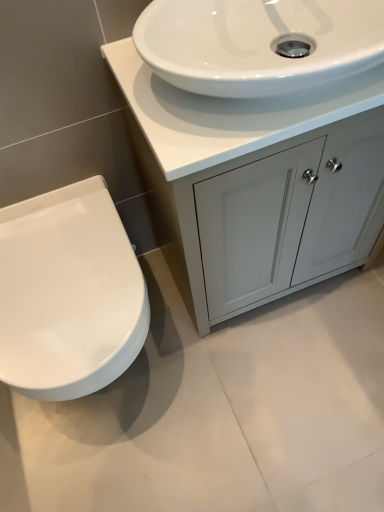
What is the approximate width of matte white cabinet at center?

It is 15.22 inches.

The image size is (384, 512). What do you see at coordinates (68, 293) in the screenshot? I see `white glossy toilet at left` at bounding box center [68, 293].

Measure the distance between white glossy sink at upper center and camera.

They are 26.61 inches apart.

I want to click on white glossy sink at upper center, so click(228, 113).

Locate an element on the screen. Image resolution: width=384 pixels, height=512 pixels. matte white cabinet at center is located at coordinates (224, 136).

Can you tell me how much white glossy sink at upper center and white glossy toilet at left differ in facing direction?

The angular difference between white glossy sink at upper center and white glossy toilet at left is 0.404 degrees.

Is white glossy sink at upper center at the left side of white glossy toilet at left?

Incorrect, white glossy sink at upper center is not on the left side of white glossy toilet at left.

Does white glossy sink at upper center come in front of white glossy toilet at left?

Yes, the depth of white glossy sink at upper center is less than that of white glossy toilet at left.

Is white glossy sink at upper center taller than white glossy toilet at left?

No.

From the image's perspective, relative to matte white cabinet at center, is white glossy toilet at left above or below?

Based on their image positions, white glossy toilet at left is located beneath matte white cabinet at center.

Is white glossy toilet at left touching matte white cabinet at center?

No, white glossy toilet at left is not in contact with matte white cabinet at center.

Is white glossy toilet at left smaller than matte white cabinet at center?

Correct, white glossy toilet at left occupies less space than matte white cabinet at center.

Which of these two, white glossy toilet at left or matte white cabinet at center, stands shorter?

Standing shorter between the two is white glossy toilet at left.

From a real-world perspective, which object stands above the other?

matte white cabinet at center, from a real-world perspective.

From the picture: Considering the sizes of objects matte white cabinet at center and white glossy toilet at left in the image provided, who is bigger, matte white cabinet at center or white glossy toilet at left?

With larger size is matte white cabinet at center.

Is matte white cabinet at center not within white glossy toilet at left?

That's correct, matte white cabinet at center is outside of white glossy toilet at left.

Does point (127, 308) appear closer or farther from the camera than point (176, 164)?

Point (127, 308).

Where is `counter top on the right side of white glossy toilet at left`? The height and width of the screenshot is (512, 384). counter top on the right side of white glossy toilet at left is located at coordinates (228, 113).

Is white glossy toilet at left not close to white glossy sink at upper center?

white glossy toilet at left is actually quite close to white glossy sink at upper center.

Can you confirm if white glossy toilet at left is wider than white glossy sink at upper center?

Correct, the width of white glossy toilet at left exceeds that of white glossy sink at upper center.

Is matte white cabinet at center not near white glossy sink at upper center?

matte white cabinet at center is near white glossy sink at upper center, not far away.

Does point (323, 124) come closer to viewer compared to point (264, 134)?

That is False.

Is matte white cabinet at center positioned with its back to white glossy sink at upper center?

No, matte white cabinet at center is not facing away from white glossy sink at upper center.

From a real-world perspective, is matte white cabinet at center over white glossy sink at upper center?

Actually, matte white cabinet at center is physically below white glossy sink at upper center in the real world.

Considering the relative sizes of white glossy sink at upper center and matte white cabinet at center in the image provided, is white glossy sink at upper center taller than matte white cabinet at center?

In fact, white glossy sink at upper center may be shorter than matte white cabinet at center.

Considering the positions of objects white glossy sink at upper center and matte white cabinet at center in the image provided, who is behind, white glossy sink at upper center or matte white cabinet at center?

matte white cabinet at center is behind.

How many degrees apart are the facing directions of white glossy sink at upper center and matte white cabinet at center?

There is a 0.00183-degree angle between the facing directions of white glossy sink at upper center and matte white cabinet at center.

Which object is positioned more to the left, white glossy sink at upper center or matte white cabinet at center?

white glossy sink at upper center.

Locate an element on the screen. This screenshot has height=512, width=384. counter top that appears above the white glossy toilet at left (from a real-world perspective) is located at coordinates (228, 113).

At what (x,y) coordinates should I click in order to perform the action: click on toilet that is under the matte white cabinet at center (from a real-world perspective). Please return your answer as a coordinate pair (x, y). The image size is (384, 512). Looking at the image, I should click on (68, 293).

Based on their spatial positions, is white glossy toilet at left or matte white cabinet at center further from white glossy sink at upper center?

white glossy toilet at left is further to white glossy sink at upper center.

Estimate the real-world distances between objects in this image. Which object is further from white glossy toilet at left, matte white cabinet at center or white glossy sink at upper center?

white glossy sink at upper center lies further to white glossy toilet at left than the other object.

Looking at the image, which one is located further to matte white cabinet at center, white glossy sink at upper center or white glossy toilet at left?

white glossy toilet at left is positioned further to the anchor matte white cabinet at center.

In the scene shown: Estimate the real-world distances between objects in this image. Which object is closer to matte white cabinet at center, white glossy toilet at left or white glossy sink at upper center?

Among the two, white glossy sink at upper center is located nearer to matte white cabinet at center.

From the image, which object appears to be farther from white glossy sink at upper center, matte white cabinet at center or white glossy toilet at left?

white glossy toilet at left.

Based on their spatial positions, is white glossy sink at upper center or matte white cabinet at center further from white glossy toilet at left?

white glossy sink at upper center lies further to white glossy toilet at left than the other object.

This screenshot has width=384, height=512. I want to click on counter top between white glossy toilet at left and matte white cabinet at center in the horizontal direction, so click(228, 113).